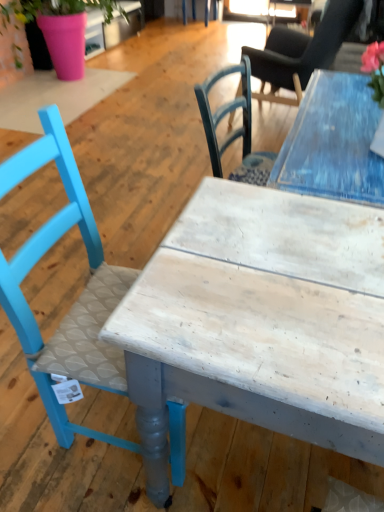
Question: From the image's perspective, is pink matte pot at upper left above white wood table at center?

Choices:
 (A) yes
 (B) no

Answer: (A)

Question: Considering the relative sizes of pink matte pot at upper left and white wood table at center in the image provided, is pink matte pot at upper left bigger than white wood table at center?

Choices:
 (A) yes
 (B) no

Answer: (A)

Question: Is white wood table at center surrounded by pink matte pot at upper left?

Choices:
 (A) yes
 (B) no

Answer: (B)

Question: Is pink matte pot at upper left positioned far away from white wood table at center?

Choices:
 (A) no
 (B) yes

Answer: (B)

Question: Considering the relative positions of pink matte pot at upper left and white wood table at center in the image provided, is pink matte pot at upper left in front of white wood table at center?

Choices:
 (A) yes
 (B) no

Answer: (B)

Question: From a real-world perspective, is pink matte pot at upper left under white wood table at center?

Choices:
 (A) yes
 (B) no

Answer: (B)

Question: Does pink matte pot at upper left have a lesser height compared to smooth black chair at upper right, positioned as the second chair in front-to-back order?

Choices:
 (A) yes
 (B) no

Answer: (A)

Question: Is pink matte pot at upper left facing towards smooth black chair at upper right, acting as the first chair starting from the back?

Choices:
 (A) yes
 (B) no

Answer: (A)

Question: Are pink matte pot at upper left and smooth black chair at upper right, the 2th chair from the left, located far from each other?

Choices:
 (A) yes
 (B) no

Answer: (A)

Question: From a real-world perspective, is pink matte pot at upper left on top of smooth black chair at upper right, the 1th chair in the right-to-left sequence?

Choices:
 (A) no
 (B) yes

Answer: (A)

Question: Is the depth of pink matte pot at upper left greater than that of smooth black chair at upper right, positioned as the second chair in front-to-back order?

Choices:
 (A) no
 (B) yes

Answer: (B)

Question: Is the position of pink matte pot at upper left less distant than that of smooth black chair at upper right, positioned as the second chair in front-to-back order?

Choices:
 (A) no
 (B) yes

Answer: (A)

Question: Considering the relative sizes of smooth black chair at upper right, arranged as the 2th chair when ordered from the bottom, and pink matte pot at upper left in the image provided, is smooth black chair at upper right, arranged as the 2th chair when ordered from the bottom, thinner than pink matte pot at upper left?

Choices:
 (A) yes
 (B) no

Answer: (A)